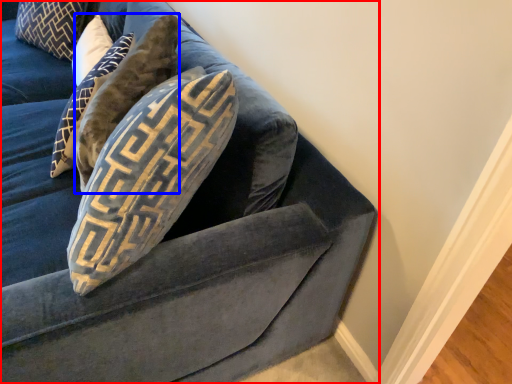
Question: Which of the following is the farthest to the observer, studio couch (highlighted by a red box) or pillow (highlighted by a blue box)?

Choices:
 (A) studio couch
 (B) pillow

Answer: (B)